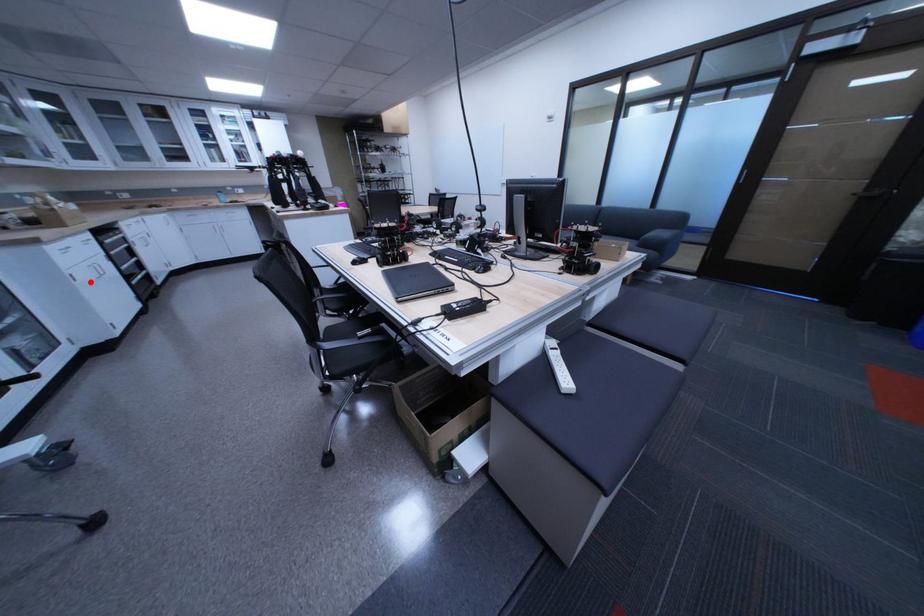
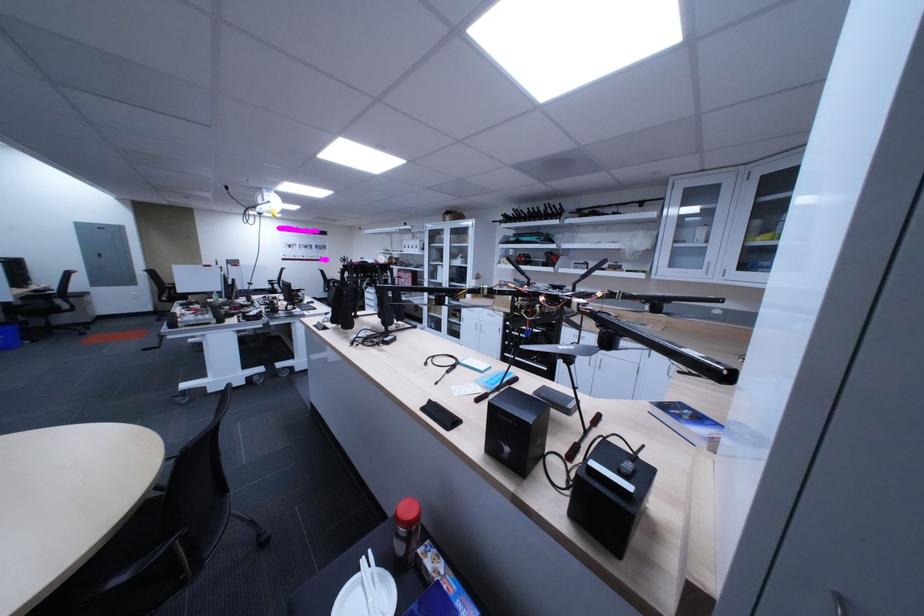
Question: I am providing you with two images of the same scene from different viewpoints. A red point is shown in image1. For the corresponding object point in image2, is it positioned nearer or farther from the camera?

Choices:
 (A) Nearer
 (B) Farther

Answer: (A)